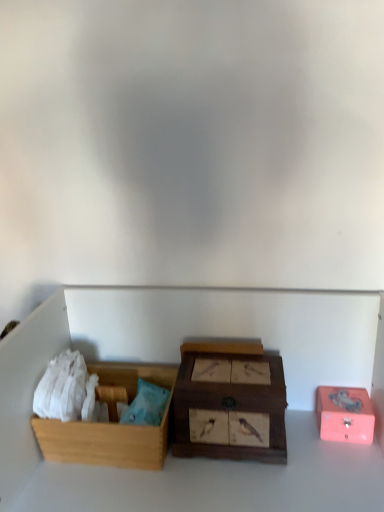
Question: From a real-world perspective, is pink matte box at right, arranged as the 3th box when viewed from the left, physically below wooden box with bird pictures at center, positioned as the 2th box in right-to-left order?

Choices:
 (A) yes
 (B) no

Answer: (A)

Question: Is the position of pink matte box at right, arranged as the 3th box when viewed from the left, more distant than that of wooden box with bird pictures at center, which appears as the 2th box when viewed from the left?

Choices:
 (A) yes
 (B) no

Answer: (A)

Question: Is pink matte box at right, which is the 1th box in right-to-left order, aimed at wooden box with bird pictures at center, which appears as the 2th box when viewed from the left?

Choices:
 (A) no
 (B) yes

Answer: (A)

Question: Does pink matte box at right, arranged as the 3th box when viewed from the left, have a greater height compared to wooden box with bird pictures at center, positioned as the 2th box in right-to-left order?

Choices:
 (A) yes
 (B) no

Answer: (B)

Question: From the image's perspective, is pink matte box at right, arranged as the 3th box when viewed from the left, below wooden box with bird pictures at center, which appears as the 2th box when viewed from the left?

Choices:
 (A) yes
 (B) no

Answer: (A)

Question: Considering the relative positions of wooden box at left, placed as the 3th box when sorted from right to left, and wooden box with bird pictures at center, positioned as the 2th box in right-to-left order, in the image provided, is wooden box at left, placed as the 3th box when sorted from right to left, to the left or to the right of wooden box with bird pictures at center, positioned as the 2th box in right-to-left order,?

Choices:
 (A) left
 (B) right

Answer: (A)

Question: Considering their positions, is wooden box at left, placed as the 3th box when sorted from right to left, located in front of or behind wooden box with bird pictures at center, which appears as the 2th box when viewed from the left?

Choices:
 (A) front
 (B) behind

Answer: (B)

Question: Is wooden box at left, positioned as the first box in left-to-right order, situated inside wooden box with bird pictures at center, which appears as the 2th box when viewed from the left, or outside?

Choices:
 (A) inside
 (B) outside

Answer: (B)

Question: From the image's perspective, is wooden box at left, positioned as the first box in left-to-right order, located above or below wooden box with bird pictures at center, which appears as the 2th box when viewed from the left?

Choices:
 (A) below
 (B) above

Answer: (A)

Question: Would you say wooden box with bird pictures at center, positioned as the 2th box in right-to-left order, is inside or outside pink matte box at right, arranged as the 3th box when viewed from the left?

Choices:
 (A) outside
 (B) inside

Answer: (A)

Question: In terms of width, does wooden box with bird pictures at center, which appears as the 2th box when viewed from the left, look wider or thinner when compared to pink matte box at right, which is the 1th box in right-to-left order?

Choices:
 (A) thin
 (B) wide

Answer: (B)

Question: Does point (236, 456) appear closer or farther from the camera than point (367, 436)?

Choices:
 (A) closer
 (B) farther

Answer: (A)

Question: Visually, is wooden box with bird pictures at center, positioned as the 2th box in right-to-left order, positioned to the left or to the right of pink matte box at right, arranged as the 3th box when viewed from the left?

Choices:
 (A) right
 (B) left

Answer: (B)

Question: From their relative heights in the image, would you say pink matte box at right, which is the 1th box in right-to-left order, is taller or shorter than wooden box with bird pictures at center, which appears as the 2th box when viewed from the left?

Choices:
 (A) short
 (B) tall

Answer: (A)

Question: Is pink matte box at right, arranged as the 3th box when viewed from the left, inside or outside of wooden box with bird pictures at center, which appears as the 2th box when viewed from the left?

Choices:
 (A) inside
 (B) outside

Answer: (B)